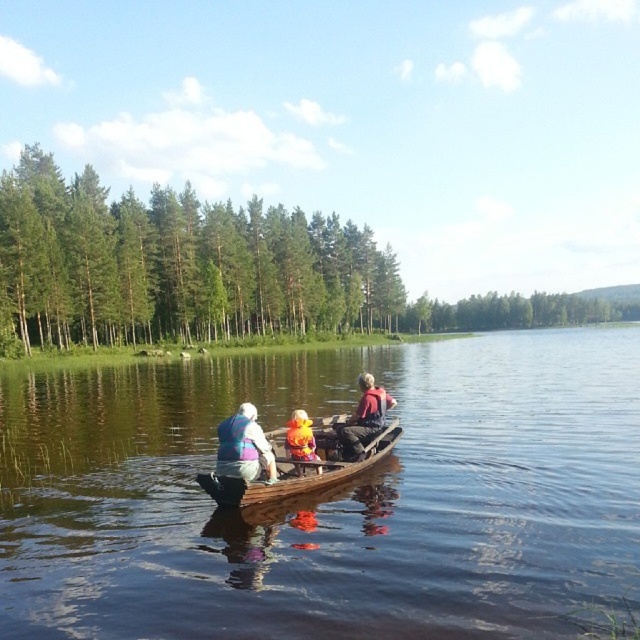
In order to click on transparent water at boat center in this screenshot , I will do `click(328, 497)`.

Does transparent water at boat center have a greater height compared to reddish-brown leather jacket at center?

Yes, transparent water at boat center is taller than reddish-brown leather jacket at center.

Which is in front, point (556, 390) or point (340, 444)?

Positioned in front is point (340, 444).

This screenshot has width=640, height=640. Identify the location of transparent water at boat center. (328, 497).

Is point (381, 440) closer to camera compared to point (292, 436)?

That is False.

Can you confirm if brown wooden boat at center is positioned above yellow fabric toy at center?

Incorrect, brown wooden boat at center is not positioned above yellow fabric toy at center.

Between point (301, 474) and point (316, 454), which one is positioned behind?

Positioned behind is point (301, 474).

You are a GUI agent. You are given a task and a screenshot of the screen. Output one action in this format:
    pyautogui.click(x=<x>, y=<y>)
    Task: Click on the brown wooden boat at center
    The image size is (640, 640).
    Given the screenshot: What is the action you would take?
    pyautogui.click(x=305, y=468)

Is point (433, 472) in front of point (273, 476)?

That is False.

What do you see at coordinates (328, 497) in the screenshot? Image resolution: width=640 pixels, height=640 pixels. I see `transparent water at boat center` at bounding box center [328, 497].

I want to click on transparent water at boat center, so click(328, 497).